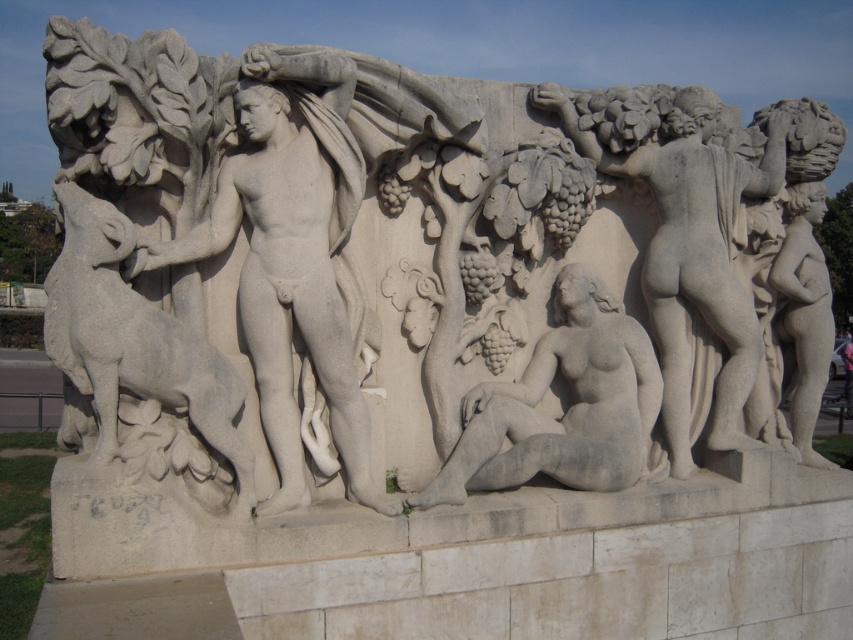
Question: Which point is closer to the camera?

Choices:
 (A) (267, 115)
 (B) (689, 192)

Answer: (A)

Question: Is white stone statue at left further to the viewer compared to white marble figure at right?

Choices:
 (A) no
 (B) yes

Answer: (A)

Question: Among these objects, which one is farthest from the camera?

Choices:
 (A) white stone statue at left
 (B) white marble figure at right

Answer: (B)

Question: Does white stone statue at left have a greater width compared to white marble figure at right?

Choices:
 (A) no
 (B) yes

Answer: (A)

Question: Is white stone statue at left below white marble figure at right?

Choices:
 (A) no
 (B) yes

Answer: (B)